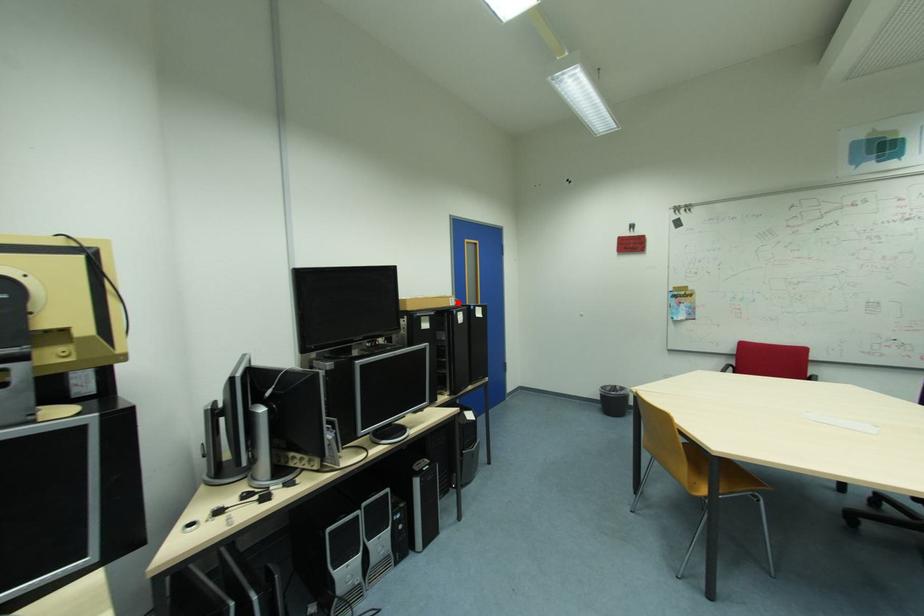
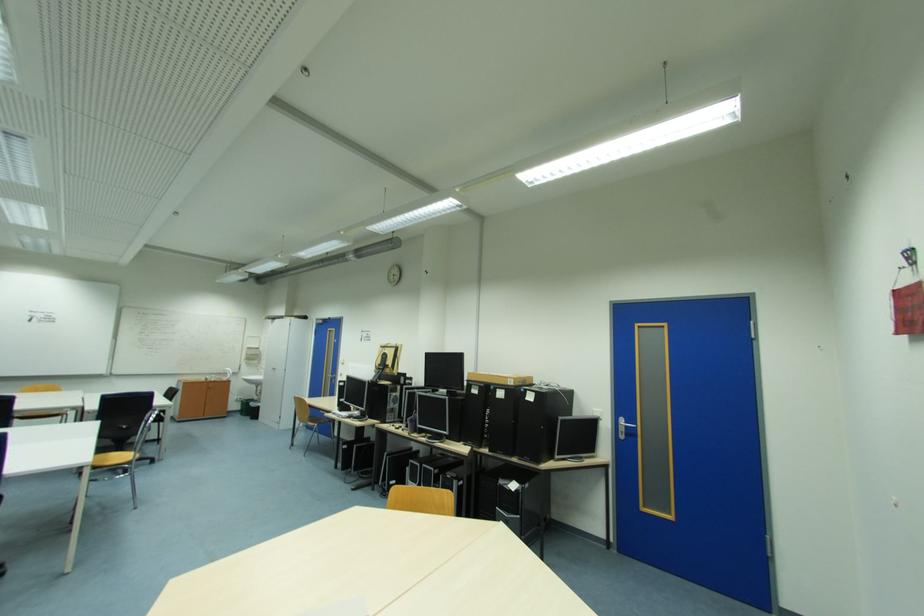
Where in the second image is the point corresponding to the highlighted location from the first image?

(517, 382)